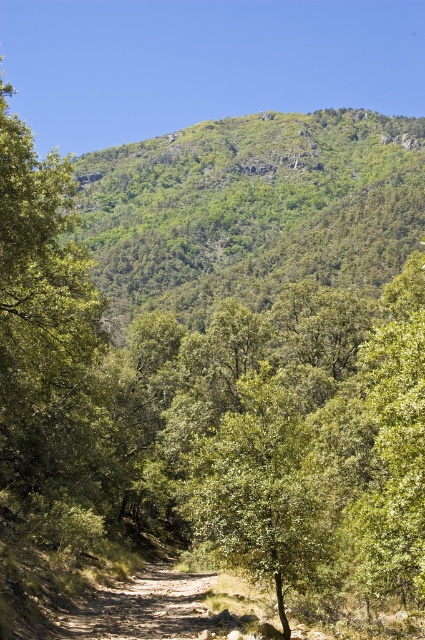
You are a hiker standing at the start of the dirt path and want to reach the highest point visible in the scene. Which object should you aim for, the green leafy hillside at upper center or the green leafy tree at center?

The green leafy hillside at upper center is much taller than the green leafy tree at center, so you should aim for the green leafy hillside at upper center to reach the highest point visible in the scene.

You are a hiker planning to take a photo of the green leafy hillside at upper center and the green leafy tree at center. Which object should you focus on first if you want to capture both in a single frame without moving the camera?

You should focus on the green leafy hillside at upper center first because it is larger in size compared to the green leafy tree at center, ensuring it is properly framed before adjusting for the smaller tree.